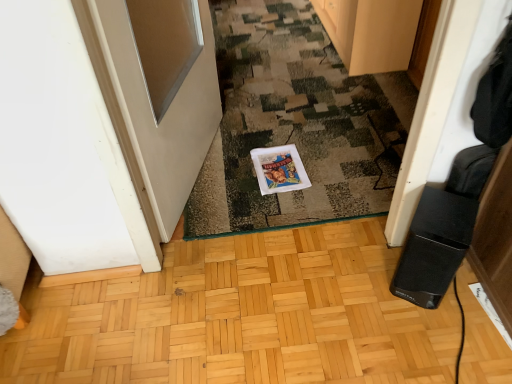
The height and width of the screenshot is (384, 512). I want to click on empty space that is to the right of black plastic speaker at lower right, so click(468, 293).